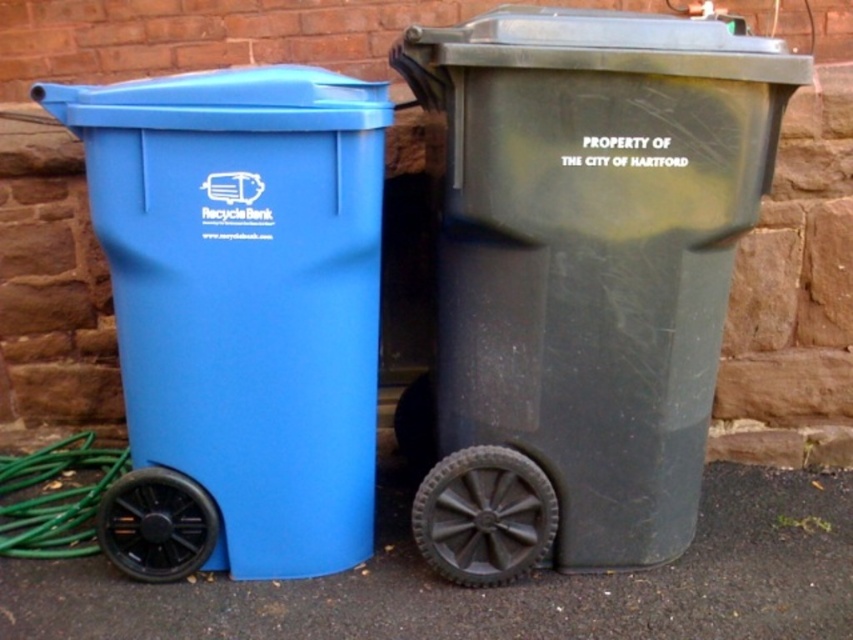
Question: Which object is farther from the camera taking this photo?

Choices:
 (A) black rubber wheel at lower center
 (B) black rubber wheel at lower left
 (C) matte plastic recycling bin at left

Answer: (A)

Question: Which point is farther from the camera taking this photo?

Choices:
 (A) (149, 515)
 (B) (511, 516)
 (C) (57, 502)

Answer: (C)

Question: Does black rubber wheel at lower center appear under black rubber wheel at lower left?

Choices:
 (A) yes
 (B) no

Answer: (B)

Question: Does black rubber wheel at lower left have a larger size compared to green rubber garden hose at lower left?

Choices:
 (A) yes
 (B) no

Answer: (B)

Question: In this image, where is black rubber wheel at lower left located relative to green rubber garden hose at lower left?

Choices:
 (A) below
 (B) above

Answer: (A)

Question: Which of these objects is positioned farthest from the black rubber wheel at lower center?

Choices:
 (A) matte plastic recycling bin at left
 (B) black rubber wheel at lower left
 (C) green rubber garden hose at lower left

Answer: (C)